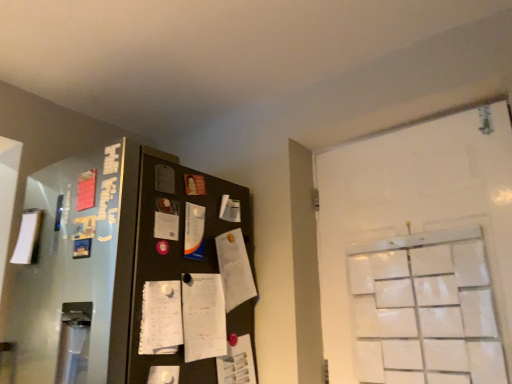
Question: Are white glossy paper at center, the second paper when ordered from right to left, and white paper notepad at center making contact?

Choices:
 (A) yes
 (B) no

Answer: (B)

Question: From the image's perspective, does white glossy paper at center, which is the third paper in bottom-to-top order, appear higher than white paper notepad at center?

Choices:
 (A) no
 (B) yes

Answer: (B)

Question: Is white glossy paper at center, the second paper when ordered from right to left, closer to the viewer compared to white paper notepad at center?

Choices:
 (A) no
 (B) yes

Answer: (A)

Question: Is white glossy paper at center, the second paper viewed from the left, oriented away from white paper notepad at center?

Choices:
 (A) no
 (B) yes

Answer: (A)

Question: Is white glossy paper at center, acting as the first paper starting from the top, outside of white paper notepad at center?

Choices:
 (A) yes
 (B) no

Answer: (A)

Question: From the image's perspective, does white glossy paper at center, the second paper viewed from the left, appear lower than white paper notepad at center?

Choices:
 (A) no
 (B) yes

Answer: (A)

Question: Is white matte paper at left, positioned as the third paper in right-to-left order, positioned far away from white paper notepad at center?

Choices:
 (A) no
 (B) yes

Answer: (A)

Question: Is white matte paper at left, positioned as the third paper in right-to-left order, further to the viewer compared to white paper notepad at center?

Choices:
 (A) no
 (B) yes

Answer: (B)

Question: Can you confirm if white matte paper at left, positioned as the third paper in right-to-left order, is wider than white paper notepad at center?

Choices:
 (A) no
 (B) yes

Answer: (B)

Question: Is white paper notepad at center at the back of white matte paper at left, which is the first paper from left to right?

Choices:
 (A) no
 (B) yes

Answer: (A)

Question: Can you confirm if white matte paper at left, which is the first paper from left to right, is shorter than white paper notepad at center?

Choices:
 (A) yes
 (B) no

Answer: (A)

Question: Considering the relative sizes of white matte paper at left, which is the first paper from left to right, and white paper notepad at center in the image provided, is white matte paper at left, which is the first paper from left to right, bigger than white paper notepad at center?

Choices:
 (A) yes
 (B) no

Answer: (B)

Question: Does white matte paper at left, which is the first paper from left to right, appear on the left side of white matte door at right?

Choices:
 (A) yes
 (B) no

Answer: (A)